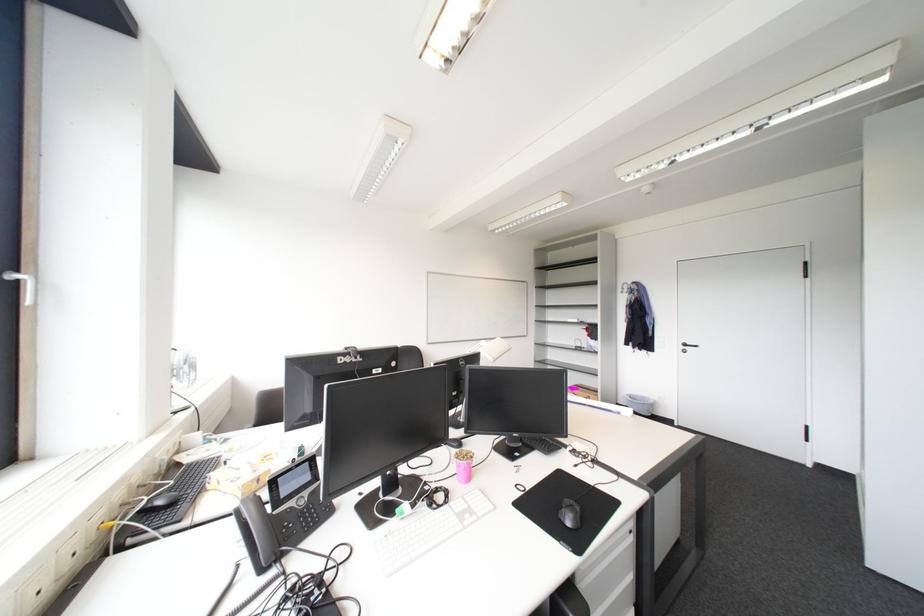
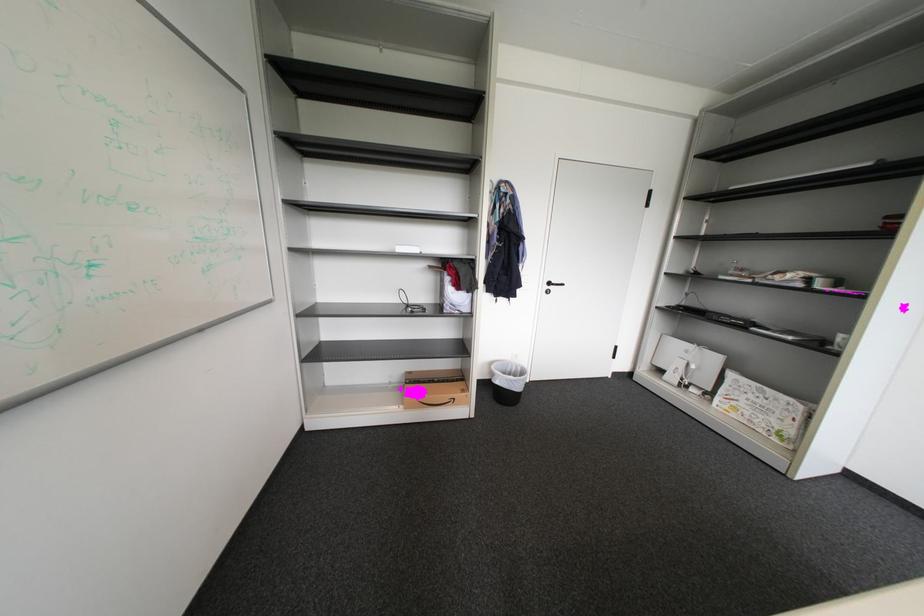
Find the pixel in the second image that matches pixel 695 346 in the first image.

(560, 285)